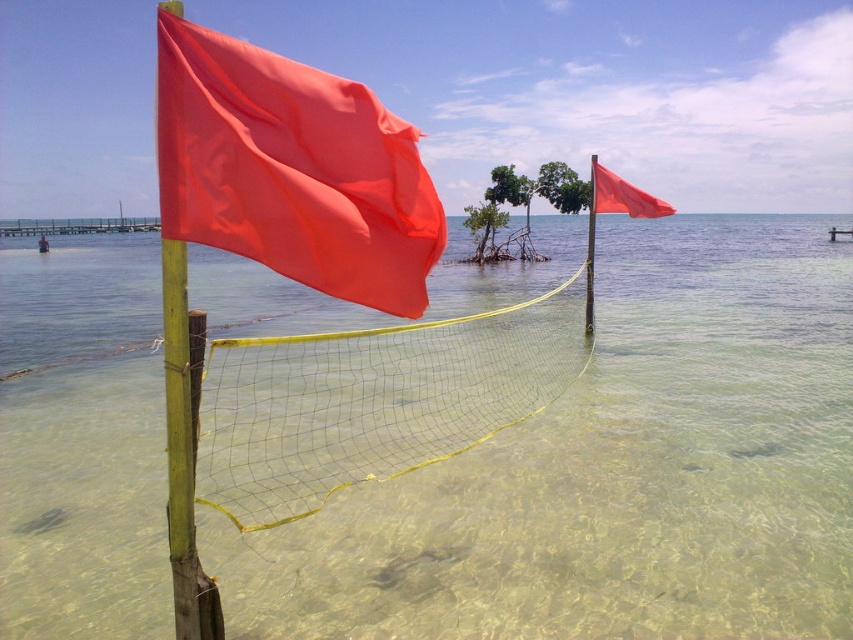
You are standing at the edge of the wooden pier in the coastal scene. There is a point marked at coordinates point (567,492). Can you reach that point by walking straight ahead from your current position?

The point (567,492) is 6.27 meters away from the viewer. Since the wooden pier extends into the water and you are at its edge, walking straight ahead along the pier would allow you to reach the point as it is within a reachable distance.

You are standing at the point marked as point (613, 472) in the image. What is the immediate environment around you?

The immediate environment around point (613, 472) is clear water at center.

You are a photographer standing at the edge of the wooden pier. You want to take a photo that includes both the yellow mesh net at center and the matte orange flag at upper right. Which object will appear larger in your photo?

The yellow mesh net at center will appear larger in the photo because it is closer to the viewer than the matte orange flag at upper right.